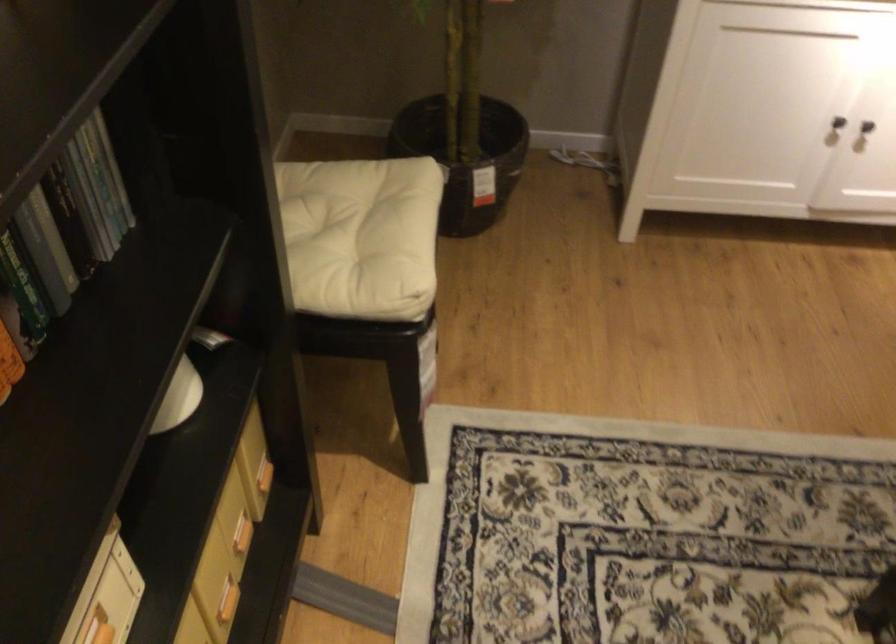
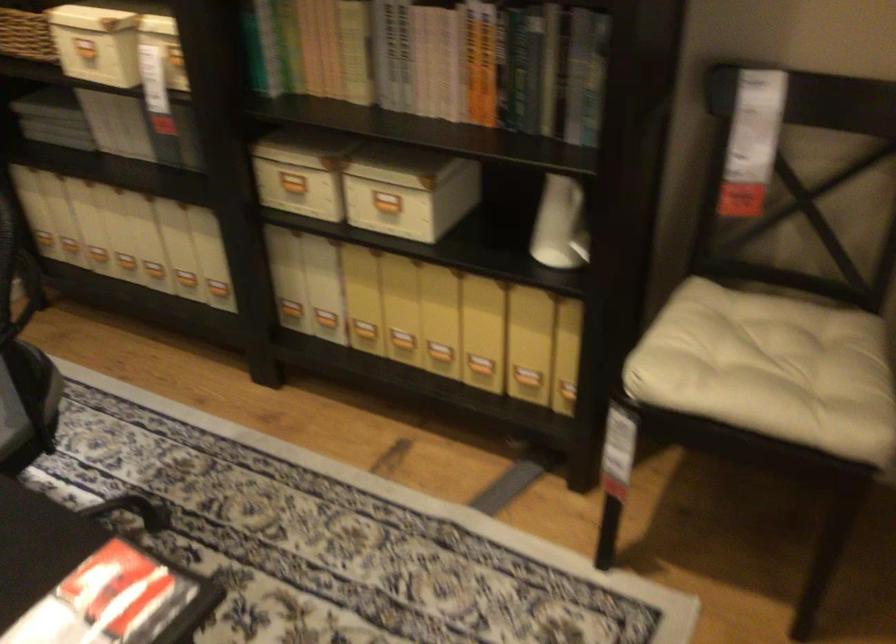
The point at (341, 242) is marked in the first image. Where is the corresponding point in the second image?

(776, 366)